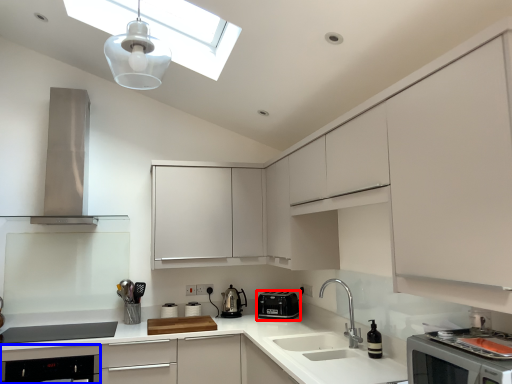
Question: Which object appears farthest to the camera in this image, kitchen appliance (highlighted by a red box) or dish washer (highlighted by a blue box)?

Choices:
 (A) kitchen appliance
 (B) dish washer

Answer: (A)